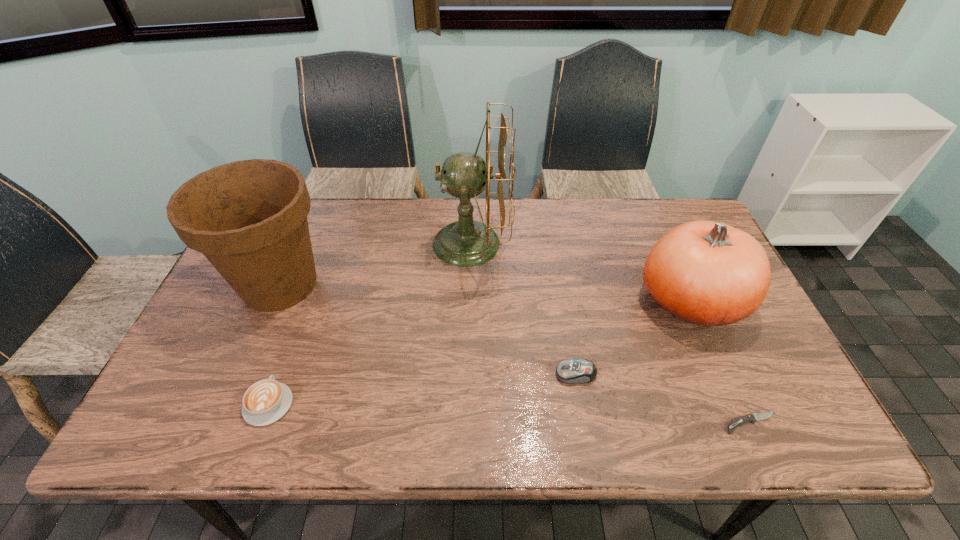
I want to click on free spot between the third object from left to right and the third tallest object, so click(581, 272).

Image resolution: width=960 pixels, height=540 pixels. I want to click on vacant space that's between the third object from right to left and the flowerpot, so click(x=428, y=329).

What are the coordinates of `free space between the fourth shortest object and the shortest object` in the screenshot? It's located at (721, 362).

At what (x,y) coordinates should I click in order to perform the action: click on free spot between the flowerpot and the shortest object. Please return your answer as a coordinate pair (x, y). The width and height of the screenshot is (960, 540). Looking at the image, I should click on (516, 354).

What are the coordinates of `free space between the pumpkin and the shortest object` in the screenshot? It's located at (721, 362).

Find the location of a particular element. blank region between the shortest object and the third tallest object is located at coordinates (721, 362).

Image resolution: width=960 pixels, height=540 pixels. What are the coordinates of `vacant space in between the pumpkin and the fourth object from left to right` in the screenshot? It's located at (634, 338).

Locate an element on the screen. The height and width of the screenshot is (540, 960). object that stands as the fifth closest to the pumpkin is located at coordinates (266, 401).

Point out which object is positioned as the nearest to the pumpkin. Please provide its 2D coordinates. Your answer should be formatted as a tuple, i.e. [(x, y)], where the tuple contains the x and y coordinates of a point satisfying the conditions above.

[(571, 371)]

This screenshot has width=960, height=540. Find the location of `free region that satisfies the following two spatial constraints: 1. on the back side of the pocketknife; 2. on the wheel side of the computer mouse`. free region that satisfies the following two spatial constraints: 1. on the back side of the pocketknife; 2. on the wheel side of the computer mouse is located at coordinates (729, 374).